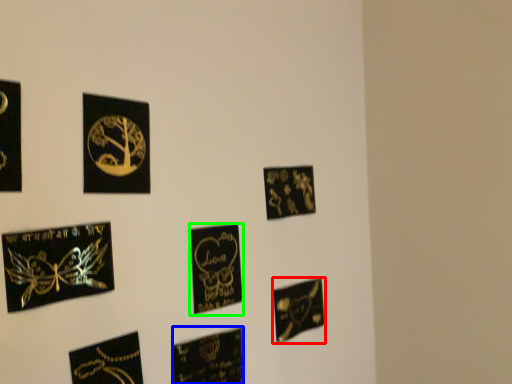
Question: Which is farther away from picture frame (highlighted by a red box)? picture frame (highlighted by a blue box) or picture frame (highlighted by a green box)?

Choices:
 (A) picture frame
 (B) picture frame

Answer: (B)